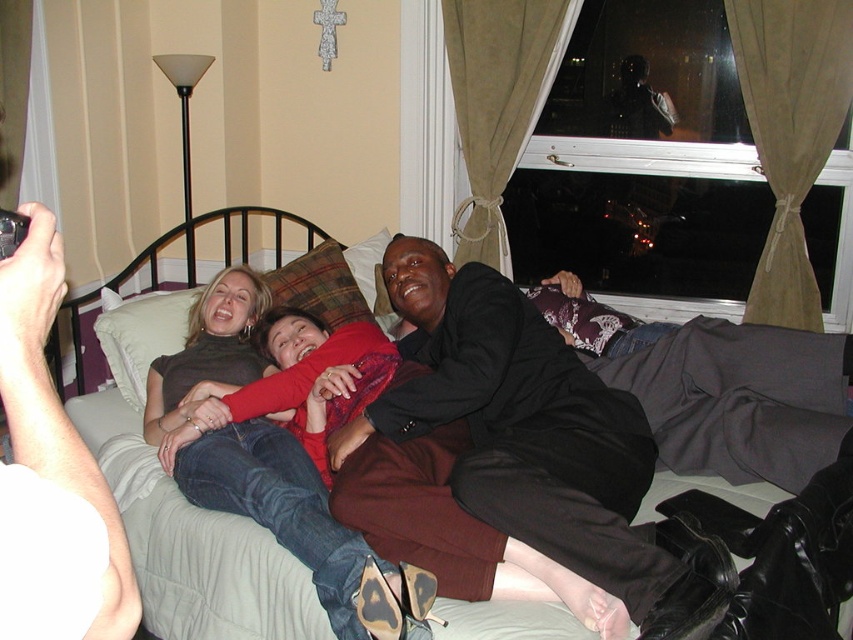
Which is below, light gray fabric bed at center or plaid fabric pillow at center?

light gray fabric bed at center is below.

Does light gray fabric bed at center have a smaller size compared to plaid fabric pillow at center?

Incorrect, light gray fabric bed at center is not smaller in size than plaid fabric pillow at center.

Identify the location of light gray fabric bed at center. (740, 397).

Who is higher up, light gray fabric bed at center or denim jeans at center?

Positioned higher is denim jeans at center.

Does light gray fabric bed at center come in front of denim jeans at center?

No, it is not.

Find the location of a particular element. The image size is (853, 640). light gray fabric bed at center is located at coordinates (740, 397).

The height and width of the screenshot is (640, 853). What are the coordinates of `light gray fabric bed at center` in the screenshot? It's located at (740, 397).

Can you confirm if dark brown leather jacket at center is shorter than denim jeans at center?

Incorrect, dark brown leather jacket at center's height does not fall short of denim jeans at center's.

Who is shorter, dark brown leather jacket at center or denim jeans at center?

Standing shorter between the two is denim jeans at center.

Which is in front, point (438, 419) or point (202, 467)?

Point (202, 467) is more forward.

The height and width of the screenshot is (640, 853). Identify the location of dark brown leather jacket at center. (532, 435).